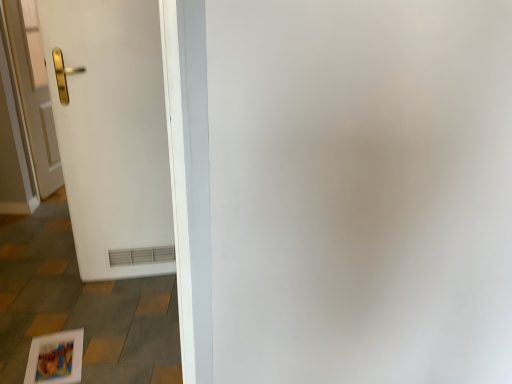
Question: Does white matte door at left, marked as the 1th door in a front-to-back arrangement, have a greater width compared to gold metallic handle at left, positioned as the 1th door in back-to-front order?

Choices:
 (A) no
 (B) yes

Answer: (B)

Question: Is white matte door at left, which is the second door from back to front, thinner than gold metallic handle at left, positioned as the 1th door in back-to-front order?

Choices:
 (A) no
 (B) yes

Answer: (A)

Question: Is white matte door at left, which appears as the 1th door when viewed from the right, smaller than gold metallic handle at left, which is the 2th door in front-to-back order?

Choices:
 (A) no
 (B) yes

Answer: (A)

Question: Can you confirm if white matte door at left, which appears as the 1th door when viewed from the right, is positioned to the right of gold metallic handle at left, the second door in the right-to-left sequence?

Choices:
 (A) no
 (B) yes

Answer: (B)

Question: Is white matte door at left, which appears as the second door when viewed from the left, taller than gold metallic handle at left, the 1th door from the left?

Choices:
 (A) yes
 (B) no

Answer: (A)

Question: From a real-world perspective, is white matte door at left, marked as the 1th door in a front-to-back arrangement, over gold metallic handle at left, positioned as the 1th door in back-to-front order?

Choices:
 (A) yes
 (B) no

Answer: (A)

Question: Is gold metallic handle at left, the 1th door from the left, not inside white matte door at left, which appears as the second door when viewed from the left?

Choices:
 (A) yes
 (B) no

Answer: (A)

Question: Is gold metallic handle at left, positioned as the 1th door in back-to-front order, turned away from white matte door at left, which is the second door from back to front?

Choices:
 (A) no
 (B) yes

Answer: (A)

Question: Does gold metallic handle at left, positioned as the 1th door in back-to-front order, have a lesser width compared to white matte door at left, which appears as the second door when viewed from the left?

Choices:
 (A) no
 (B) yes

Answer: (B)

Question: Does gold metallic handle at left, the 1th door from the left, have a greater height compared to white matte door at left, which is the second door from back to front?

Choices:
 (A) no
 (B) yes

Answer: (A)

Question: Is gold metallic handle at left, the 1th door from the left, wider than white matte door at left, which is the second door from back to front?

Choices:
 (A) no
 (B) yes

Answer: (A)

Question: Is gold metallic handle at left, the 1th door from the left, aimed at white matte door at left, marked as the 1th door in a front-to-back arrangement?

Choices:
 (A) no
 (B) yes

Answer: (A)

Question: In terms of height, does white matte door at left, which is the second door from back to front, look taller or shorter compared to gold metallic handle at left, the 1th door from the left?

Choices:
 (A) tall
 (B) short

Answer: (A)